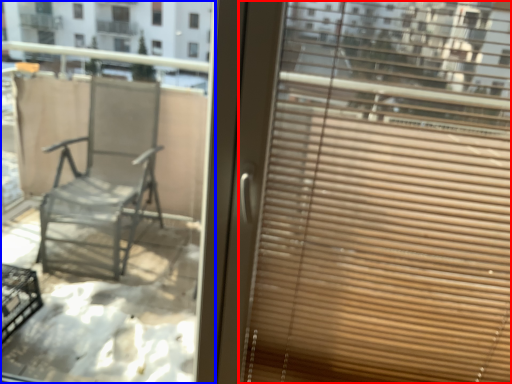
Question: Among these objects, which one is farthest to the camera, window blind (highlighted by a red box) or window (highlighted by a blue box)?

Choices:
 (A) window blind
 (B) window

Answer: (B)